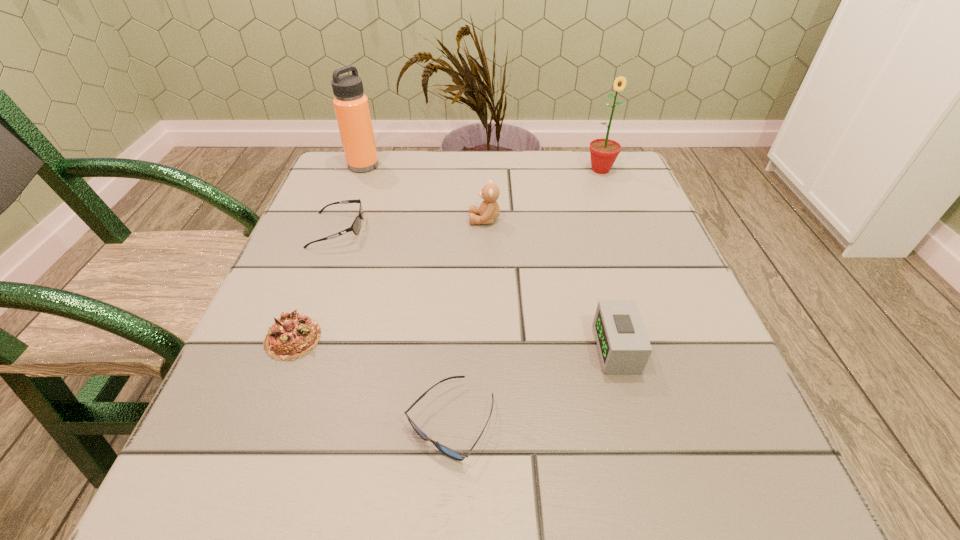
Identify the location of vacant space located on the front of the thermos bottle. (343, 220).

The width and height of the screenshot is (960, 540). Identify the location of vacant space located on the face of the rightmost object. pos(615,209).

Identify the location of vacant position located 0.310m on the front-facing side of the fifth shortest object. (325, 220).

Locate an element on the screen. free space located 0.270m on the front-facing side of the fifth shortest object is located at coordinates (344, 220).

Locate an element on the screen. free space located on the front-facing side of the fifth shortest object is located at coordinates (437, 220).

Locate an element on the screen. This screenshot has height=540, width=960. vacant space situated on the front-facing side of the alarm clock is located at coordinates (535, 348).

Locate an element on the screen. The width and height of the screenshot is (960, 540). vacant space located on the front-facing side of the alarm clock is located at coordinates (347, 348).

The height and width of the screenshot is (540, 960). I want to click on blank area located 0.320m on the front-facing side of the alarm clock, so click(396, 348).

You are a GUI agent. You are given a task and a screenshot of the screen. Output one action in this format:
    pyautogui.click(x=<x>, y=<y>)
    Task: Click on the free space located on the front-facing side of the farther sunglasses
    
    Given the screenshot: What is the action you would take?
    pyautogui.click(x=522, y=230)

You are a GUI agent. You are given a task and a screenshot of the screen. Output one action in this format:
    pyautogui.click(x=<x>, y=<y>)
    Task: Click on the vacant space located 0.130m on the front of the chocolate cake
    This screenshot has height=540, width=960.
    Given the screenshot: What is the action you would take?
    pyautogui.click(x=253, y=442)